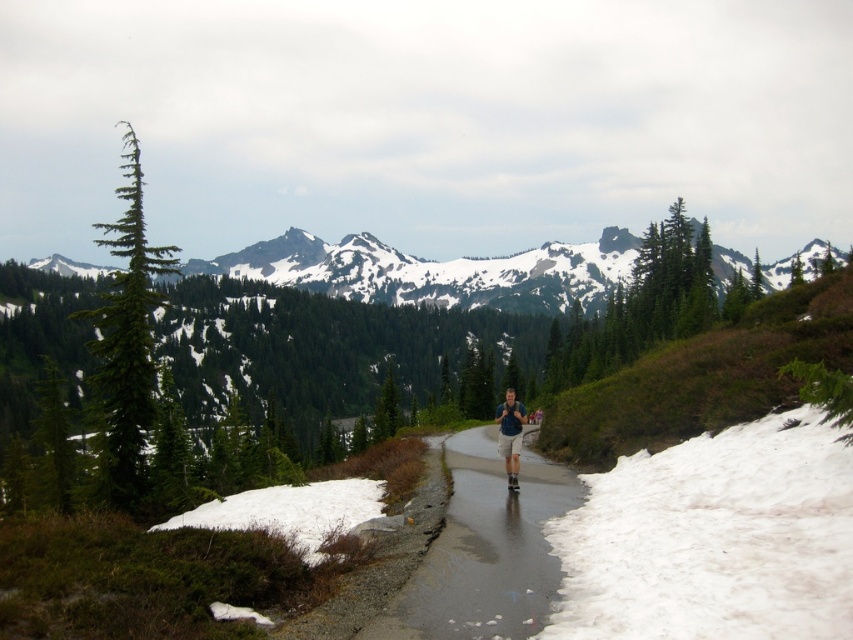
You are a hiker planning to walk along the narrow, wet path bordered by patches of snow. You see a green matte pine represented by point (126,339). Which direction should you head to avoid the snow patches on both sides?

The green matte pine at point (126,339) is located at the left side of the path. To avoid the snow patches on both sides, you should head towards the center of the path where there is less snow.

You are hiking on a mountain trail and notice a shiny asphalt road at center and a blue fabric shirt at center. Which object is shorter in height?

The shiny asphalt road at center is shorter in height than the blue fabric shirt at center.

You are a hiker planning to take a photo of the green matte pine at left and the white fluffy snow at lower left. Which object should you focus on first if you want both to be in clear focus, given that the pine is larger?

The green matte pine at left is larger in size than the white fluffy snow at lower left, so you should focus on the green matte pine at left first to ensure both are in clear focus.